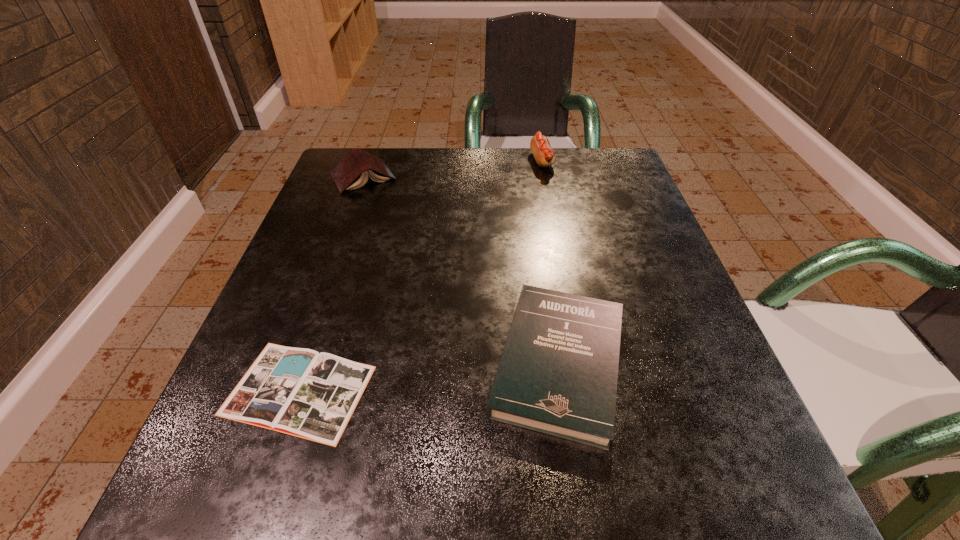
Image resolution: width=960 pixels, height=540 pixels. I want to click on book that stands as the second closest to the shortest book, so click(x=352, y=171).

Find the location of a particular element. free point that satisfies the following two spatial constraints: 1. on the back side of the sausage; 2. on the left side of the farthest book is located at coordinates (369, 161).

Find the location of a particular element. vacant point that satisfies the following two spatial constraints: 1. on the front side of the farthest book; 2. on the right side of the rightmost book is located at coordinates (296, 363).

Where is `free space that satisfies the following two spatial constraints: 1. on the back side of the sausage; 2. on the left side of the shortest book`? free space that satisfies the following two spatial constraints: 1. on the back side of the sausage; 2. on the left side of the shortest book is located at coordinates 376,161.

You are a GUI agent. You are given a task and a screenshot of the screen. Output one action in this format:
    pyautogui.click(x=<x>, y=<y>)
    Task: Click on the vacant area in the image that satisfies the following two spatial constraints: 1. on the back side of the shortest book; 2. on the left side of the third tallest object
    
    Given the screenshot: What is the action you would take?
    pyautogui.click(x=308, y=363)

Image resolution: width=960 pixels, height=540 pixels. I want to click on free space that satisfies the following two spatial constraints: 1. on the back side of the shortest object; 2. on the left side of the second shortest book, so click(x=308, y=363).